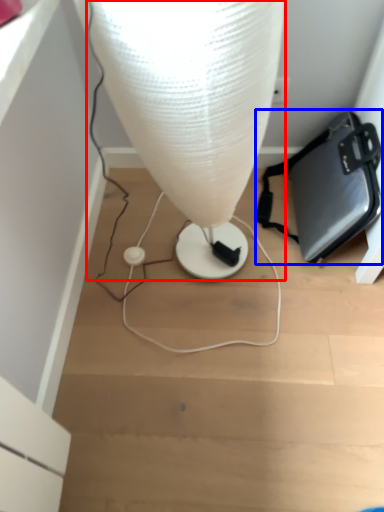
Question: Which object appears farthest to the camera in this image, lamp (highlighted by a red box) or handbag (highlighted by a blue box)?

Choices:
 (A) lamp
 (B) handbag

Answer: (B)